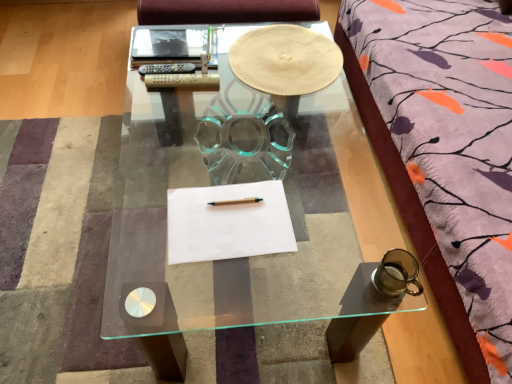
You are a GUI agent. You are given a task and a screenshot of the screen. Output one action in this format:
    pyautogui.click(x=<x>, y=<y>)
    Task: Click on the vacant space in matte cardboard plate at center (from a real-world perspective)
    
    Given the screenshot: What is the action you would take?
    click(x=259, y=147)